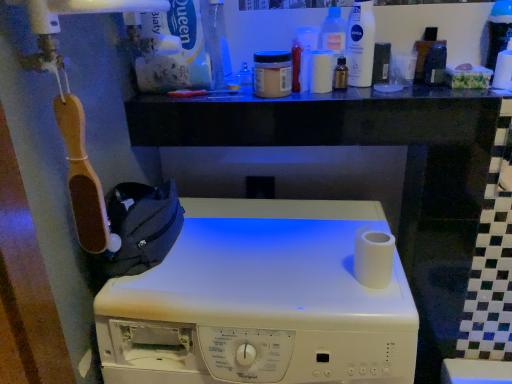
Locate an element on the screen. Image resolution: width=512 pixels, height=384 pixels. vacant area that is in front of matte black container at upper right, the first toiletry when ordered from right to left is located at coordinates (450, 96).